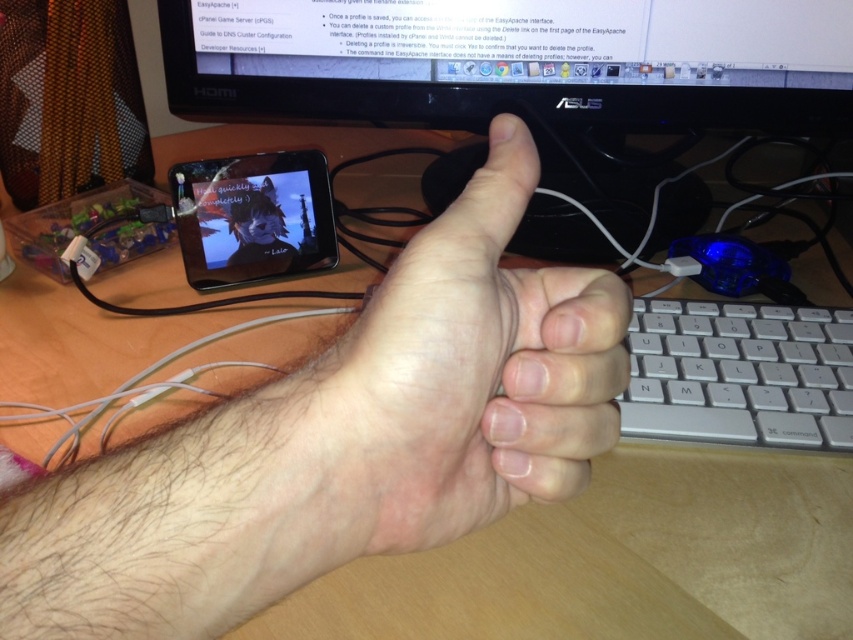
Consider the image. You are setting up a new computer workstation and need to ensure proper ergonomics. Based on the image, is the skinny flesh at center positioned above or below the matte black tablet at center?

The skinny flesh at center is positioned below the matte black tablet at center according to the description.

You are trying to locate a specific point in the image. The point is labeled as point (520, 72). According to the scene description, where exactly is this point located?

The point (520, 72) is on the black plastic monitor at upper center.

You are setting up a computer desk and need to arrange the black plastic monitor at upper center and the silver metallic keyboard at right. According to the image, which object should be placed on the left side of the desk?

The black plastic monitor at upper center should be placed on the left side of the desk because it is positioned to the left of the silver metallic keyboard at right in the image.